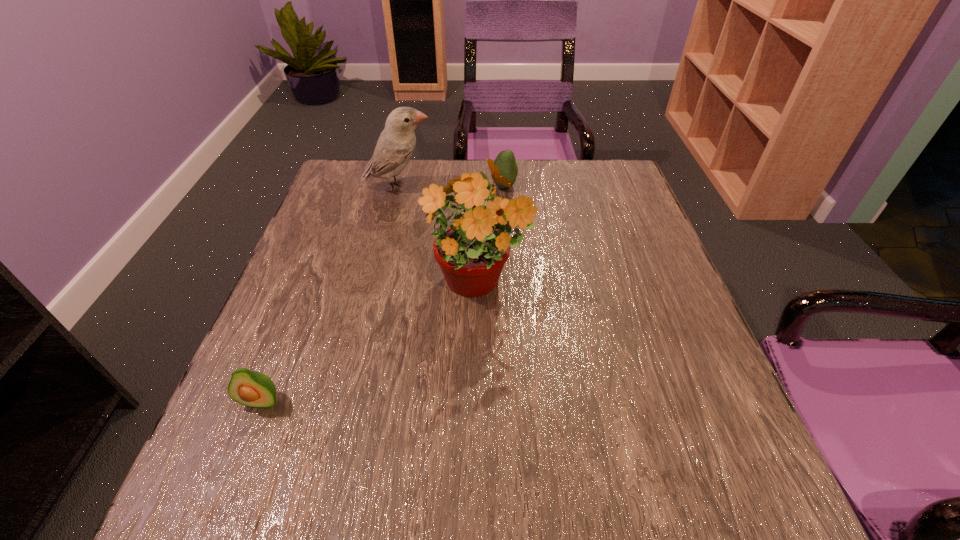
Locate an element on the screen. free space that satisfies the following two spatial constraints: 1. at the face of the tallest object; 2. on the right side of the third object from right to left is located at coordinates [374, 286].

I want to click on free space that satisfies the following two spatial constraints: 1. at the face of the third shortest object; 2. on the back side of the third farthest object, so click(x=374, y=286).